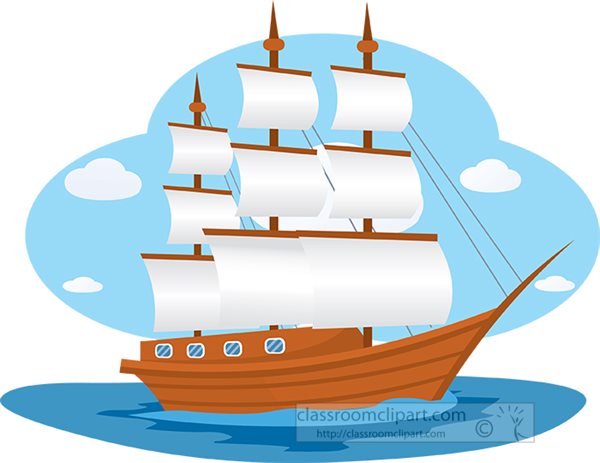
Identify the location of windows. (279, 346).